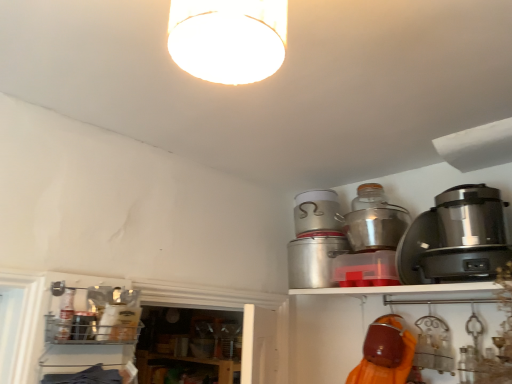
Question: In terms of height, does brushed metal canister at lower left, the fourth appliance viewed from the right, look taller or shorter compared to metallic silver pot at upper center, the 2th appliance positioned from the right?

Choices:
 (A) short
 (B) tall

Answer: (A)

Question: Considering the relative positions of brushed metal canister at lower left, the fourth appliance viewed from the right, and metallic silver pot at upper center, which is the third appliance from left to right, in the image provided, is brushed metal canister at lower left, the fourth appliance viewed from the right, to the left or to the right of metallic silver pot at upper center, which is the third appliance from left to right,?

Choices:
 (A) left
 (B) right

Answer: (A)

Question: Which object is positioned closest to the metallic silver canister at upper right, the second appliance from the left?

Choices:
 (A) brushed metal canister at lower left, the fourth appliance viewed from the right
 (B) metallic silver pot at upper right, placed as the 1th appliance when sorted from right to left
 (C) metallic silver pot at upper center, which is the third appliance from left to right

Answer: (C)

Question: Which object is the farthest from the brushed metal canister at lower left, placed as the 1th appliance when sorted from left to right?

Choices:
 (A) metallic silver canister at upper right, the second appliance from the left
 (B) metallic silver pot at upper center, which is the third appliance from left to right
 (C) metallic silver pot at upper right, which is the 4th appliance in left-to-right order

Answer: (C)